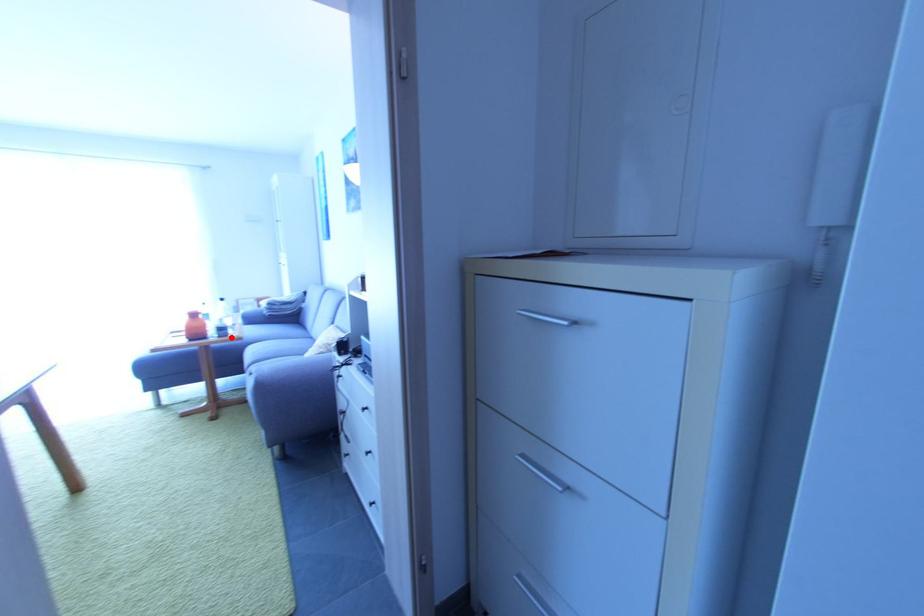
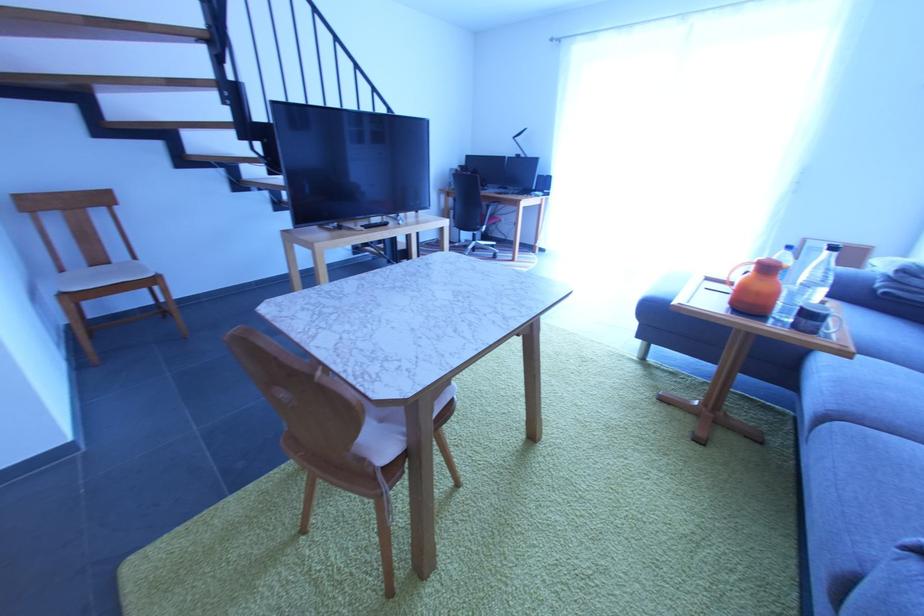
Question: I am providing you with two images of the same scene from different viewpoints. A red point is marked on the first image. Is the red point's position out of view in image 2?

Choices:
 (A) Yes
 (B) No

Answer: (B)